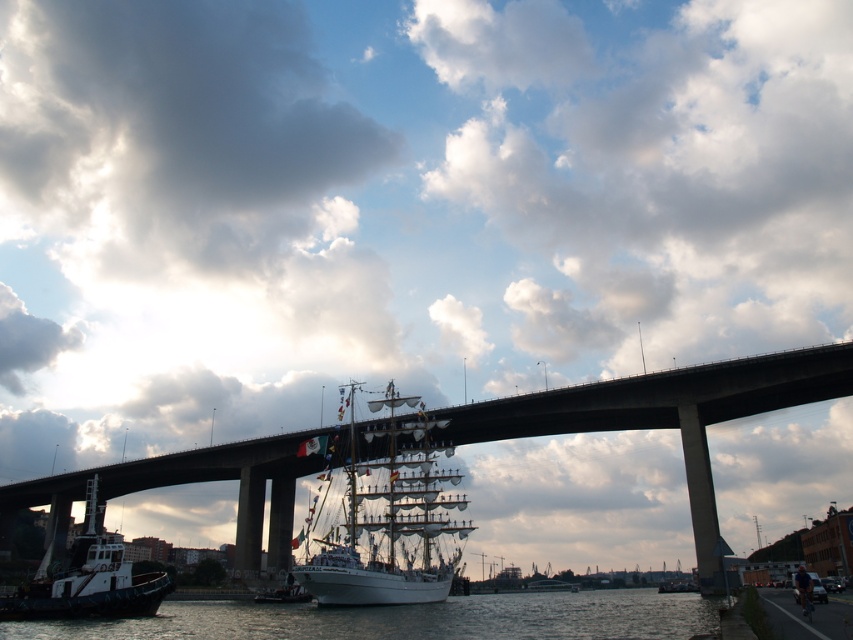
Can you confirm if white wooden ship at center is positioned to the left of white matte tugboat at lower left?

Incorrect, white wooden ship at center is not on the left side of white matte tugboat at lower left.

Is white wooden ship at center bigger than white matte tugboat at lower left?

Incorrect, white wooden ship at center is not larger than white matte tugboat at lower left.

What do you see at coordinates (387, 513) in the screenshot? I see `white wooden ship at center` at bounding box center [387, 513].

The width and height of the screenshot is (853, 640). I want to click on white wooden ship at center, so click(387, 513).

Is concrete bridge at center in front of white wooden ship at center?

No, concrete bridge at center is behind white wooden ship at center.

Can you confirm if concrete bridge at center is bigger than white wooden ship at center?

Yes.

Does point (608, 384) come in front of point (357, 429)?

Yes, it is.

At what (x,y) coordinates should I click in order to perform the action: click on concrete bridge at center. Please return your answer as a coordinate pair (x, y). The height and width of the screenshot is (640, 853). Looking at the image, I should click on [663, 413].

The height and width of the screenshot is (640, 853). What do you see at coordinates (663, 413) in the screenshot? I see `concrete bridge at center` at bounding box center [663, 413].

Looking at this image, between concrete bridge at center and white matte tugboat at lower left, which one is positioned higher?

Positioned higher is concrete bridge at center.

The height and width of the screenshot is (640, 853). What are the coordinates of `concrete bridge at center` in the screenshot? It's located at (663, 413).